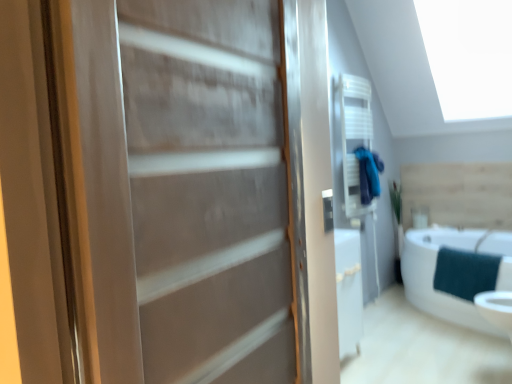
Question: From a real-world perspective, relative to teal fabric towel at lower right, is matte wood door at center vertically above or below?

Choices:
 (A) below
 (B) above

Answer: (B)

Question: Considering the positions of matte wood door at center and teal fabric towel at lower right in the image, is matte wood door at center wider or thinner than teal fabric towel at lower right?

Choices:
 (A) wide
 (B) thin

Answer: (B)

Question: Estimate the real-world distances between objects in this image. Which object is closer to the teal fabric bathrobe at upper right?

Choices:
 (A) teal fabric towel at lower right
 (B) white glossy bathtub at lower right
 (C) matte wood door at center

Answer: (B)

Question: Based on their relative distances, which object is nearer to the matte wood door at center?

Choices:
 (A) teal fabric bathrobe at upper right
 (B) teal fabric towel at lower right
 (C) white glossy bathtub at lower right

Answer: (C)